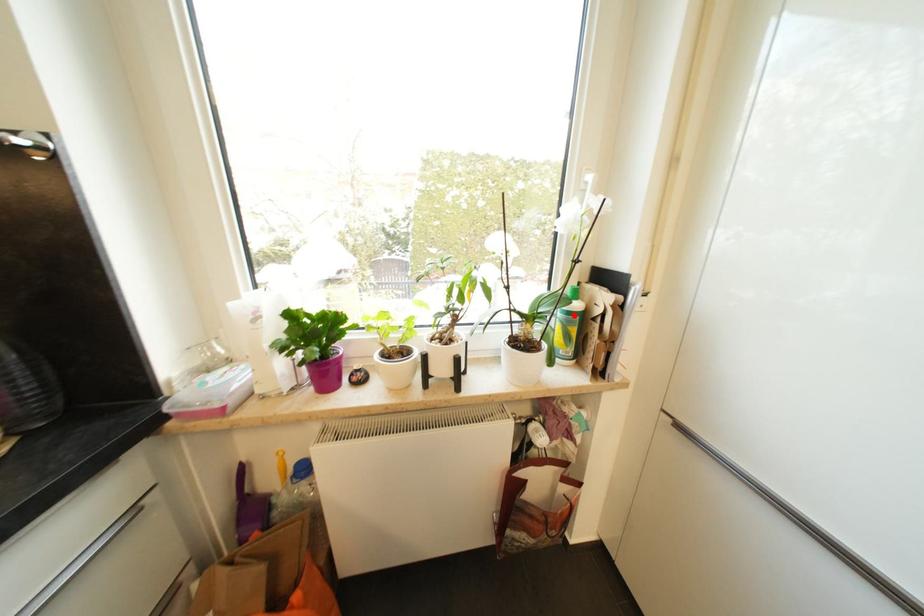
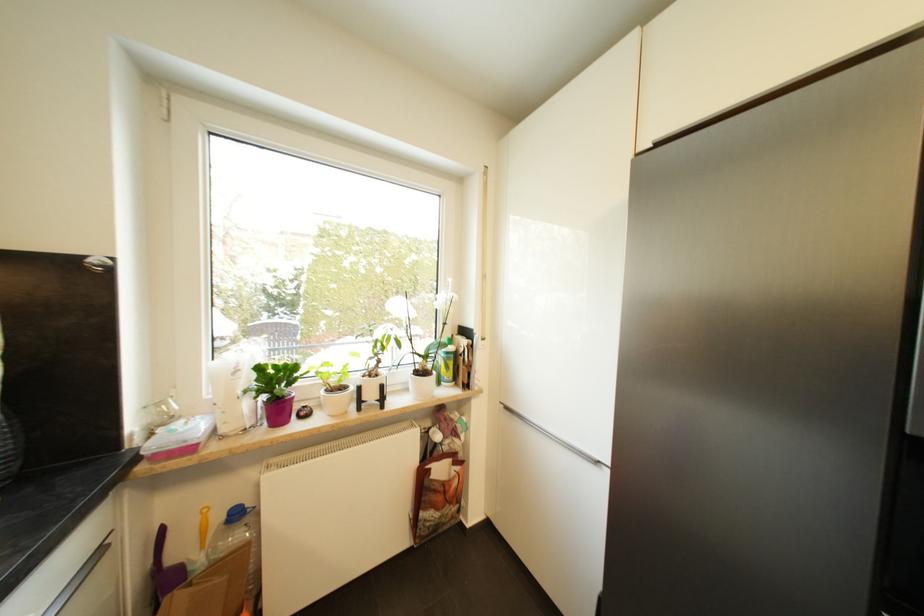
In the second image, find the point that corresponds to the highlighted location in the first image.

(453, 355)